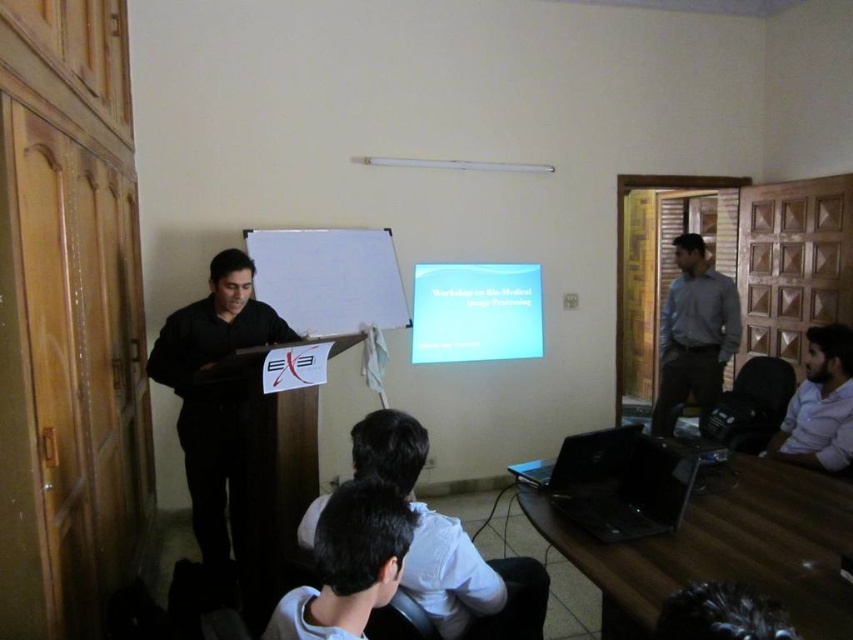
Question: Which point is closer to the camera taking this photo?

Choices:
 (A) (207, 492)
 (B) (822, 348)
 (C) (514, 467)

Answer: (A)

Question: Where is black matte laptop at center located in relation to matte white projector screen at center in the image?

Choices:
 (A) right
 (B) left

Answer: (B)

Question: Which of the following is the farthest from the observer?

Choices:
 (A) (830, 360)
 (B) (431, 307)
 (C) (229, 321)
 (D) (732, 317)

Answer: (D)

Question: Is black plastic laptop at lower right below white shirt at lower right?

Choices:
 (A) no
 (B) yes

Answer: (B)

Question: Is black matte laptop at center further to camera compared to white shirt at lower right?

Choices:
 (A) no
 (B) yes

Answer: (A)

Question: Among these objects, which one is farthest from the camera?

Choices:
 (A) matte white projector screen at center
 (B) black matte laptop at center

Answer: (A)